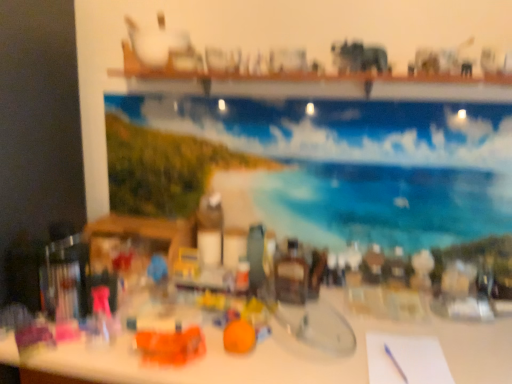
You are a GUI agent. You are given a task and a screenshot of the screen. Output one action in this format:
    pyautogui.click(x=<x>, y=<y>)
    Task: Click on the vacant space that is in between orange matte toy at center, which is counted as the first toy, starting from the right, and white paper at lower right
    
    Given the screenshot: What is the action you would take?
    pyautogui.click(x=314, y=359)